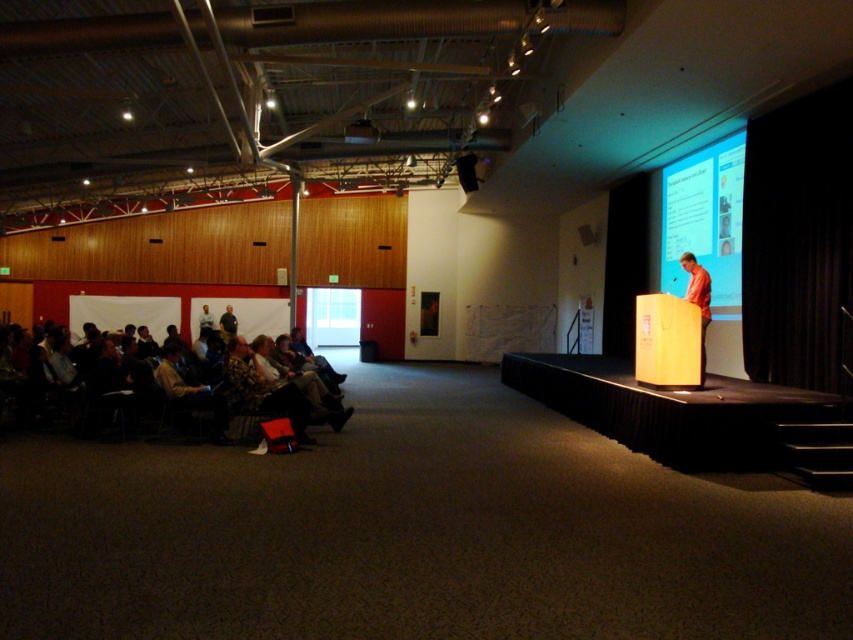
Who is more forward, (703, 291) or (228, 324)?

Point (703, 291) is in front.

Locate an element on the screen. This screenshot has width=853, height=640. orange fabric shirt at stage right is located at coordinates (698, 298).

Locate an element on the screen. Image resolution: width=853 pixels, height=640 pixels. orange fabric shirt at stage right is located at coordinates (698, 298).

Is point (90, 342) less distant than point (224, 317)?

Yes.

Can you confirm if dark brown fabric chairs at left is taller than dark gray fabric jacket at lower left?

Yes, dark brown fabric chairs at left is taller than dark gray fabric jacket at lower left.

This screenshot has width=853, height=640. Describe the element at coordinates (151, 384) in the screenshot. I see `dark brown fabric chairs at left` at that location.

You are a GUI agent. You are given a task and a screenshot of the screen. Output one action in this format:
    pyautogui.click(x=<x>, y=<y>)
    Task: Click on the dark brown fabric chairs at left
    The width and height of the screenshot is (853, 640).
    Given the screenshot: What is the action you would take?
    pyautogui.click(x=151, y=384)

Between dark brown fabric chairs at left and orange fabric shirt at stage right, which one has more height?

With more height is orange fabric shirt at stage right.

Who is lower down, dark brown fabric chairs at left or orange fabric shirt at stage right?

Positioned lower is dark brown fabric chairs at left.

The width and height of the screenshot is (853, 640). Describe the element at coordinates (151, 384) in the screenshot. I see `dark brown fabric chairs at left` at that location.

Where is `dark brown fabric chairs at left`? dark brown fabric chairs at left is located at coordinates tap(151, 384).